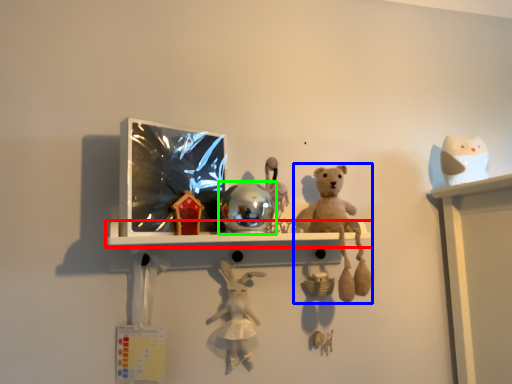
Question: Which object is the farthest from shelf (highlighted by a red box)? Choose among these: toy (highlighted by a blue box) or toy (highlighted by a green box).

Choices:
 (A) toy
 (B) toy

Answer: (A)